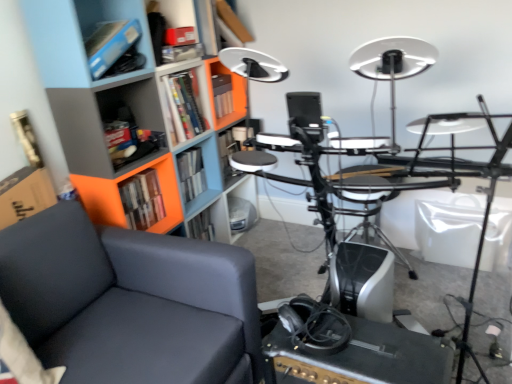
Question: From a real-world perspective, is orange plastic bookcase at left physically below matte plastic shelf at center, marked as the 3th shelf in a front-to-back arrangement?

Choices:
 (A) yes
 (B) no

Answer: (B)

Question: Does orange plastic bookcase at left appear on the left side of matte plastic shelf at center, acting as the 2th shelf starting from the back?

Choices:
 (A) no
 (B) yes

Answer: (B)

Question: Considering the relative sizes of orange plastic bookcase at left and matte plastic shelf at center, marked as the 3th shelf in a front-to-back arrangement, in the image provided, is orange plastic bookcase at left taller than matte plastic shelf at center, marked as the 3th shelf in a front-to-back arrangement,?

Choices:
 (A) no
 (B) yes

Answer: (B)

Question: Is orange plastic bookcase at left thinner than matte plastic shelf at center, which appears as the second shelf when viewed from the top?

Choices:
 (A) no
 (B) yes

Answer: (A)

Question: Considering the relative sizes of orange plastic bookcase at left and matte plastic shelf at center, acting as the 2th shelf starting from the back, in the image provided, is orange plastic bookcase at left smaller than matte plastic shelf at center, acting as the 2th shelf starting from the back,?

Choices:
 (A) yes
 (B) no

Answer: (B)

Question: Do you think matte plastic shelf at upper center, the third shelf in the back-to-front sequence, is within matte plastic shelf at lower center, which is the fourth shelf in top-to-bottom order, or outside of it?

Choices:
 (A) outside
 (B) inside

Answer: (A)

Question: Is matte plastic shelf at upper center, the third shelf in the back-to-front sequence, wider or thinner than matte plastic shelf at lower center, which is the fourth shelf in top-to-bottom order?

Choices:
 (A) wide
 (B) thin

Answer: (B)

Question: In the image, is matte plastic shelf at upper center, which is the first shelf in top-to-bottom order, positioned in front of or behind matte plastic shelf at lower center, which is counted as the first shelf, starting from the back?

Choices:
 (A) front
 (B) behind

Answer: (A)

Question: Looking at the image, does matte plastic shelf at upper center, the third shelf in the back-to-front sequence, seem bigger or smaller compared to matte plastic shelf at lower center, positioned as the 4th shelf in front-to-back order?

Choices:
 (A) small
 (B) big

Answer: (A)

Question: In terms of size, does matte black chair at left appear bigger or smaller than matte plastic shelf at lower center, positioned as the 4th shelf in front-to-back order?

Choices:
 (A) small
 (B) big

Answer: (B)

Question: Considering the positions of point (245, 375) and point (247, 228), is point (245, 375) closer or farther from the camera than point (247, 228)?

Choices:
 (A) closer
 (B) farther

Answer: (A)

Question: Would you say matte black chair at left is to the left or to the right of matte plastic shelf at lower center, which is the fourth shelf in top-to-bottom order, in the picture?

Choices:
 (A) right
 (B) left

Answer: (B)

Question: From a real-world perspective, is matte black chair at left positioned above or below matte plastic shelf at lower center, the 1th shelf from the bottom?

Choices:
 (A) above
 (B) below

Answer: (A)

Question: From the image's perspective, is hardcover book at center, marked as the 2th book in a front-to-back arrangement, above or below orange plastic bookcase at left?

Choices:
 (A) below
 (B) above

Answer: (A)

Question: Considering the positions of hardcover book at center, positioned as the 1th book in back-to-front order, and orange plastic bookcase at left in the image, is hardcover book at center, positioned as the 1th book in back-to-front order, bigger or smaller than orange plastic bookcase at left?

Choices:
 (A) big
 (B) small

Answer: (B)